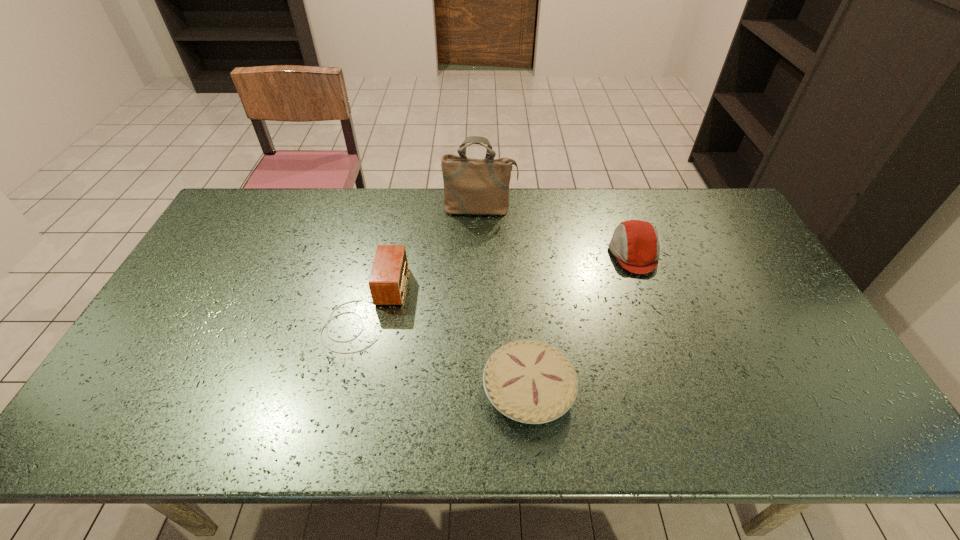
At what (x,y) coordinates should I click in order to perform the action: click on vacant space located 0.160m on the right of the shortest object. Please return your answer as a coordinate pair (x, y). The image size is (960, 540). Looking at the image, I should click on (641, 389).

This screenshot has height=540, width=960. I want to click on object positioned at the far edge, so click(471, 186).

This screenshot has height=540, width=960. Identify the location of object at the near edge. (529, 381).

Image resolution: width=960 pixels, height=540 pixels. In order to click on vacant space at the far edge of the desktop in this screenshot , I will do `click(626, 214)`.

In the image, there is a desktop. Find the location of `vacant space at the near edge`. vacant space at the near edge is located at coordinates (687, 441).

This screenshot has width=960, height=540. Find the location of `vacant position at the left edge of the desktop`. vacant position at the left edge of the desktop is located at coordinates (193, 328).

This screenshot has height=540, width=960. Identify the location of free space at the right edge. (765, 327).

This screenshot has height=540, width=960. Identify the location of vacant space at the far right corner. (691, 198).

Locate an element on the screen. The height and width of the screenshot is (540, 960). vacant area that lies between the tallest object and the pie is located at coordinates (504, 299).

At what (x,y) coordinates should I click in order to perform the action: click on free space between the cap and the shortest object. Please return your answer as a coordinate pair (x, y). Image resolution: width=960 pixels, height=540 pixels. Looking at the image, I should click on (581, 322).